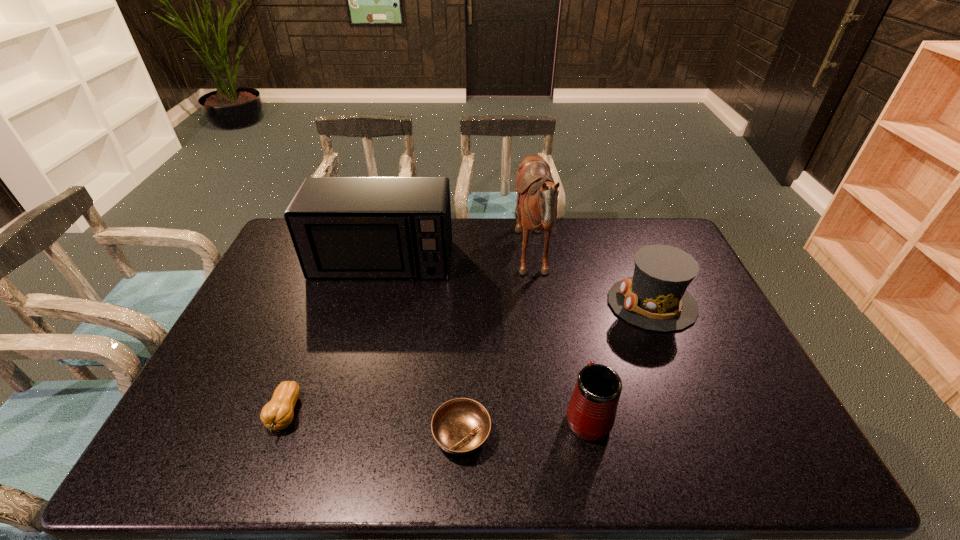
I want to click on free space between the soup bowl and the tallest object, so click(497, 348).

Identify the location of unoccupied area between the soup bowl and the tallest object. (497, 348).

Locate an element on the screen. This screenshot has height=540, width=960. unoccupied area between the gourd and the microwave_oven is located at coordinates (333, 338).

This screenshot has height=540, width=960. I want to click on unoccupied area between the microwave_oven and the saddle, so click(x=457, y=261).

Identify the location of unoccupied area between the soup bowl and the saddle. This screenshot has width=960, height=540. (497, 348).

Locate an element on the screen. empty space between the tallest object and the soup bowl is located at coordinates (497, 348).

I want to click on free area in between the mug and the microwave_oven, so click(x=485, y=338).

Locate an element on the screen. vacant point located between the tallest object and the dress hat is located at coordinates (592, 283).

Locate which object ranks fourth in proximity to the dress hat. Please provide its 2D coordinates. Your answer should be formatted as a tuple, i.e. [(x, y)], where the tuple contains the x and y coordinates of a point satisfying the conditions above.

[(341, 227)]

At what (x,y) coordinates should I click in order to perform the action: click on object that is the third closest to the microwave_oven. Please return your answer as a coordinate pair (x, y). Looking at the image, I should click on (460, 426).